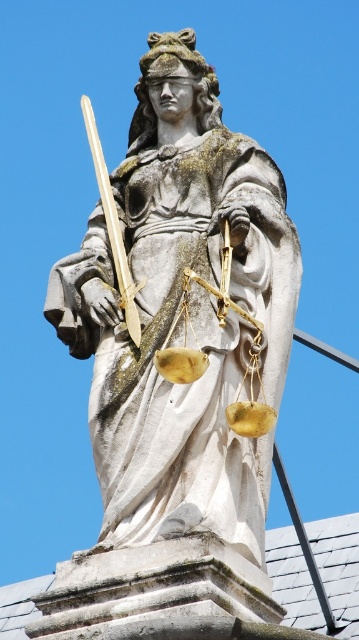
Question: Which object is closer to the camera taking this photo?

Choices:
 (A) white stone statue at center
 (B) polished gold sword at upper center

Answer: (A)

Question: Does white stone statue at center have a larger size compared to polished gold sword at upper center?

Choices:
 (A) no
 (B) yes

Answer: (A)

Question: Does white stone statue at center have a greater width compared to polished gold sword at upper center?

Choices:
 (A) no
 (B) yes

Answer: (B)

Question: Does white stone statue at center appear under polished gold sword at upper center?

Choices:
 (A) yes
 (B) no

Answer: (A)